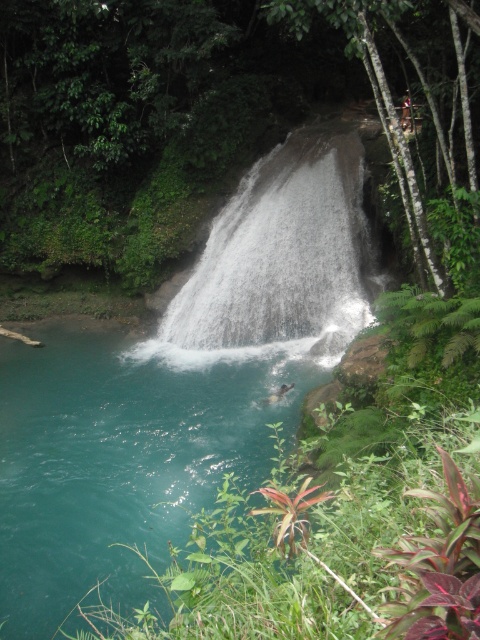
You are standing at the origin point of the coordinate system in this tropical waterfall scene. You need to locate the teal glossy water at center. What are its coordinates?

The coordinates of the teal glossy water at center are at point (121,456).

You are a photographer planning to capture the waterfall and its surroundings. You want to ensure the white textured waterfall at center is clearly visible in the background of your photo. Should you position yourself in front of or behind the teal glossy water at center to achieve this?

You should position yourself behind the teal glossy water at center because it is located below the white textured waterfall at center, allowing the waterfall to be in the background when you are behind the water.

You are standing at the edge of the waterfall and want to reach the point marked at coordinates (x=121, y=456). According to the scene description, where exactly is this point located?

The point at coordinates (x=121, y=456) is on the teal glossy water at center.